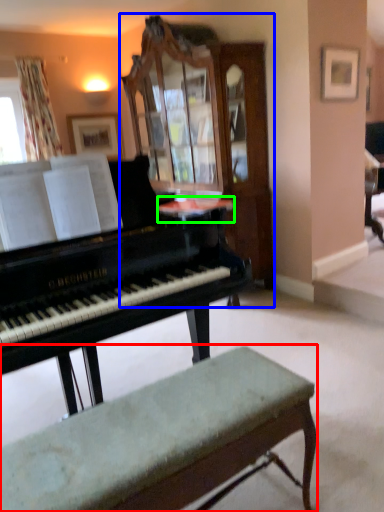
Question: Considering the real-world distances, which object is closest to bench (highlighted by a red box)? cabinetry (highlighted by a blue box) or table (highlighted by a green box).

Choices:
 (A) cabinetry
 (B) table

Answer: (B)